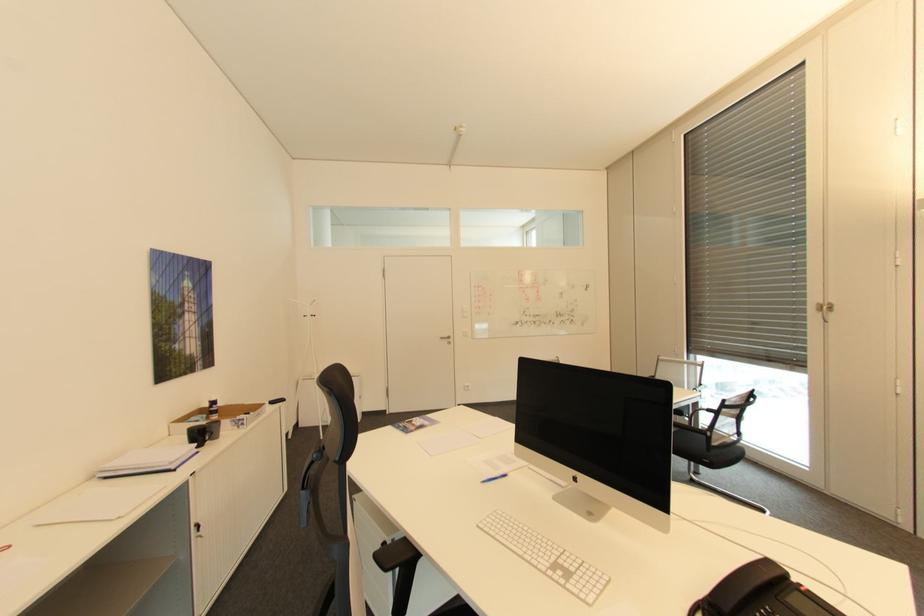
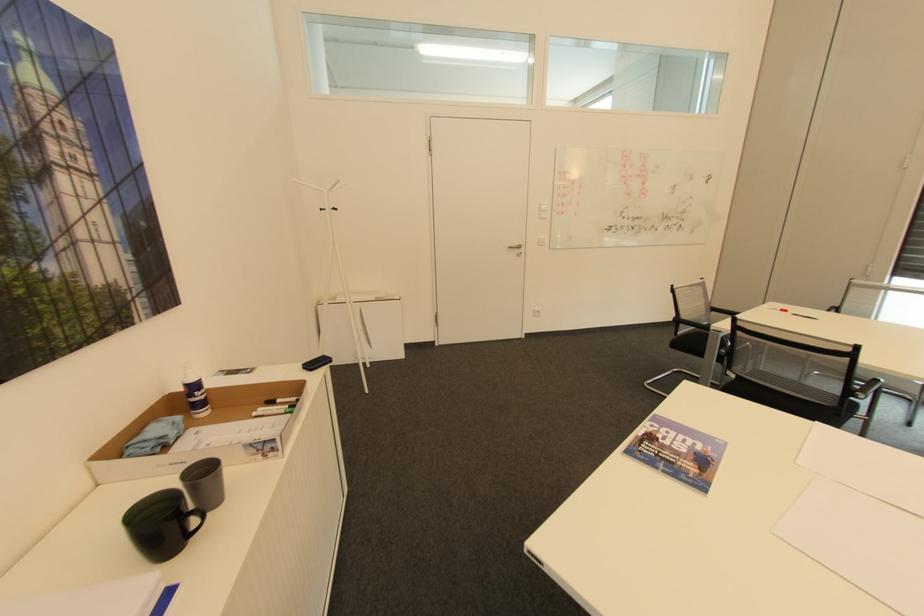
Find the pixel in the second image that matches (x=217, y=399) in the first image.

(197, 379)